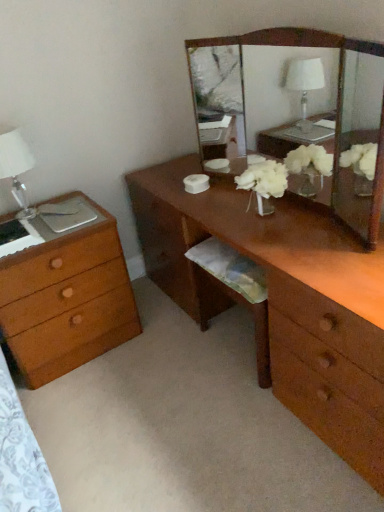
The image size is (384, 512). What do you see at coordinates (297, 113) in the screenshot?
I see `wooden mirror at center` at bounding box center [297, 113].

This screenshot has width=384, height=512. What do you see at coordinates (16, 166) in the screenshot?
I see `white glass table lamp at left` at bounding box center [16, 166].

Measure the distance between point (x=309, y=327) and camera.

Point (x=309, y=327) is 4.31 feet away from camera.

Where is `wooden chest of drawers at left`? The image size is (384, 512). wooden chest of drawers at left is located at coordinates (67, 298).

Which is correct: white glass table lamp at left is inside brown wooden desk at center, or outside of it?

white glass table lamp at left is outside brown wooden desk at center.

Is point (16, 183) closer or farther from the camera than point (372, 298)?

Clearly, point (16, 183) is more distant from the camera than point (372, 298).

Who is taller, white glass table lamp at left or brown wooden desk at center?

brown wooden desk at center.

Is white glass table lamp at left looking in the opposite direction of brown wooden desk at center?

No, white glass table lamp at left's orientation is not away from brown wooden desk at center.

Between point (269, 110) and point (15, 141), which one is positioned in front?

Positioned in front is point (15, 141).

Is wooden mirror at center thinner than white glass table lamp at left?

Yes, wooden mirror at center is thinner than white glass table lamp at left.

From a real-world perspective, between wooden mirror at center and white glass table lamp at left, who is vertically higher?

In real-world perspective, wooden mirror at center is above.

Does wooden mirror at center touch white glass table lamp at left?

No.

From a real-world perspective, is brown wooden desk at center on white glass table lamp at left?

No, from a real-world perspective, brown wooden desk at center is not above white glass table lamp at left.

Considering the relative sizes of brown wooden desk at center and white glass table lamp at left in the image provided, is brown wooden desk at center bigger than white glass table lamp at left?

Yes.

Considering the points (322, 414) and (5, 157), which point is in front, point (322, 414) or point (5, 157)?

Positioned in front is point (322, 414).

Looking at this image, can you confirm if brown wooden desk at center is taller than white glass table lamp at left?

Correct, brown wooden desk at center is much taller as white glass table lamp at left.

Could you tell me if wooden chest of drawers at left is turned towards brown wooden desk at center?

No, wooden chest of drawers at left is not oriented towards brown wooden desk at center.

Considering the positions of objects wooden chest of drawers at left and brown wooden desk at center in the image provided, who is behind, wooden chest of drawers at left or brown wooden desk at center?

wooden chest of drawers at left is further away from the camera.

From the image's perspective, is wooden chest of drawers at left located above or below brown wooden desk at center?

Clearly, from the image's perspective, wooden chest of drawers at left is below brown wooden desk at center.

Where is `mirror in front of the wooden chest of drawers at left`? mirror in front of the wooden chest of drawers at left is located at coordinates (297, 113).

Between wooden mirror at center and wooden chest of drawers at left, which one is positioned behind?

wooden chest of drawers at left is more distant.

Between point (368, 109) and point (54, 269), which one is positioned in front?

The point (54, 269) is in front.

How much distance is there between wooden mirror at center and wooden chest of drawers at left?

wooden mirror at center is 3.53 feet from wooden chest of drawers at left.

Is brown wooden desk at center not close to wooden chest of drawers at left?

That's not correct — brown wooden desk at center is a little close to wooden chest of drawers at left.

Between brown wooden desk at center and wooden chest of drawers at left, which one appears on the right side from the viewer's perspective?

brown wooden desk at center is more to the right.

Is brown wooden desk at center behind wooden chest of drawers at left?

No, brown wooden desk at center is closer to the camera.

From the image's perspective, would you say brown wooden desk at center is shown under wooden chest of drawers at left?

No, from the image's perspective, brown wooden desk at center is not below wooden chest of drawers at left.

In the image, is white glass table lamp at left positioned in front of or behind wooden chest of drawers at left?

Visually, white glass table lamp at left is located behind wooden chest of drawers at left.

Is white glass table lamp at left surrounding wooden chest of drawers at left?

No, wooden chest of drawers at left is not surrounded by white glass table lamp at left.

Looking at this image, can you confirm if white glass table lamp at left is smaller than wooden chest of drawers at left?

Correct, white glass table lamp at left occupies less space than wooden chest of drawers at left.

The width and height of the screenshot is (384, 512). What are the coordinates of `the chest of drawers in front of the white glass table lamp at left` in the screenshot? It's located at (67, 298).

Identify the location of desk in front of the white glass table lamp at left. The width and height of the screenshot is (384, 512). (283, 298).

Find the location of `mirror above the white glass table lamp at left (from a real-world perspective)`. mirror above the white glass table lamp at left (from a real-world perspective) is located at coordinates (297, 113).

In the scene shown: From the image, which object appears to be farther from white glass table lamp at left, brown wooden desk at center or wooden mirror at center?

wooden mirror at center lies further to white glass table lamp at left than the other object.

From the image, which object appears to be nearer to brown wooden desk at center, wooden chest of drawers at left or wooden mirror at center?

wooden chest of drawers at left is positioned closer to the anchor brown wooden desk at center.

From the image, which object appears to be nearer to wooden mirror at center, white glass table lamp at left or wooden chest of drawers at left?

wooden chest of drawers at left.

Which object lies further to the anchor point wooden mirror at center, white glass table lamp at left or brown wooden desk at center?

The object further to wooden mirror at center is white glass table lamp at left.

Estimate the real-world distances between objects in this image. Which object is closer to wooden mirror at center, wooden chest of drawers at left or white glass table lamp at left?

wooden chest of drawers at left.

Considering their positions, is brown wooden desk at center positioned further to wooden chest of drawers at left than white glass table lamp at left?

brown wooden desk at center is further to wooden chest of drawers at left.

From the image, which object appears to be farther from brown wooden desk at center, white glass table lamp at left or wooden mirror at center?

white glass table lamp at left is positioned further to the anchor brown wooden desk at center.

Estimate the real-world distances between objects in this image. Which object is further from brown wooden desk at center, wooden mirror at center or white glass table lamp at left?

white glass table lamp at left.

This screenshot has width=384, height=512. Find the location of `desk located between wooden chest of drawers at left and wooden mirror at center in the left-right direction`. desk located between wooden chest of drawers at left and wooden mirror at center in the left-right direction is located at coordinates (283, 298).

Find the location of `desk between white glass table lamp at left and wooden mirror at center`. desk between white glass table lamp at left and wooden mirror at center is located at coordinates (283, 298).

Where is `chest of drawers between white glass table lamp at left and wooden mirror at center in the horizontal direction`? The height and width of the screenshot is (512, 384). chest of drawers between white glass table lamp at left and wooden mirror at center in the horizontal direction is located at coordinates 67,298.

Locate an element on the screen. This screenshot has height=512, width=384. chest of drawers between white glass table lamp at left and brown wooden desk at center from left to right is located at coordinates (67, 298).